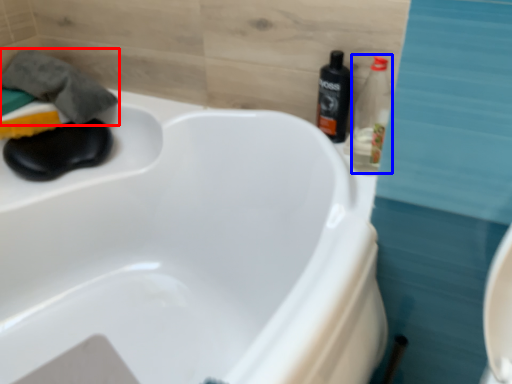
Question: Among these objects, which one is farthest to the camera, bath towel (highlighted by a red box) or bottle (highlighted by a blue box)?

Choices:
 (A) bath towel
 (B) bottle

Answer: (A)